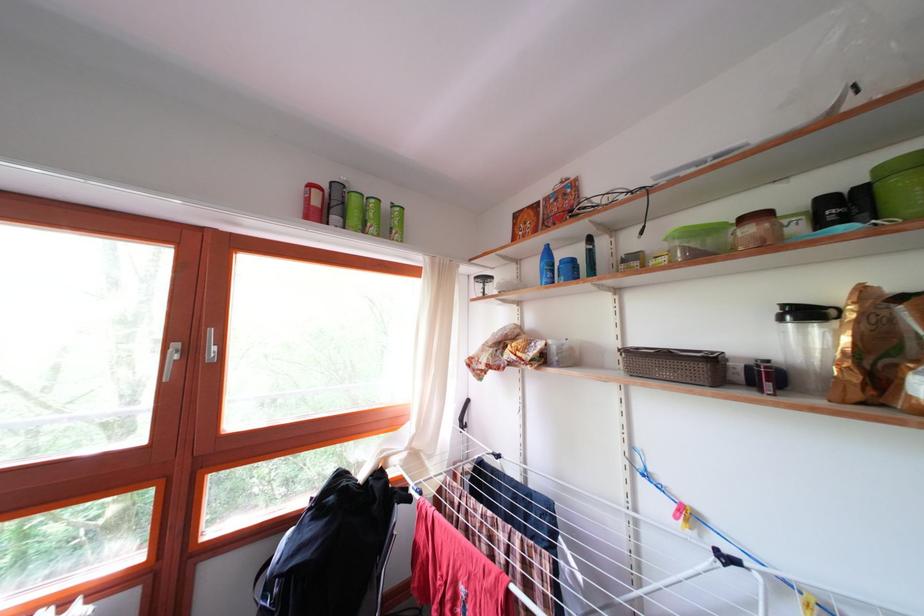
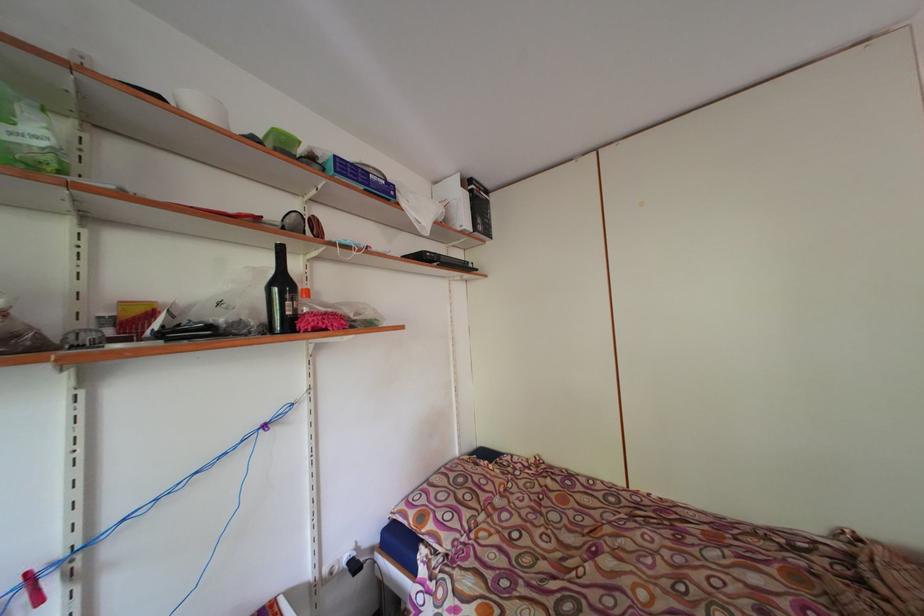
Question: The camera is either moving clockwise (left) or counter-clockwise (right) around the object. The first image is from the beginning of the video and the second image is from the end. Is the camera moving left or right when shooting the video?

Choices:
 (A) Left
 (B) Right

Answer: (A)